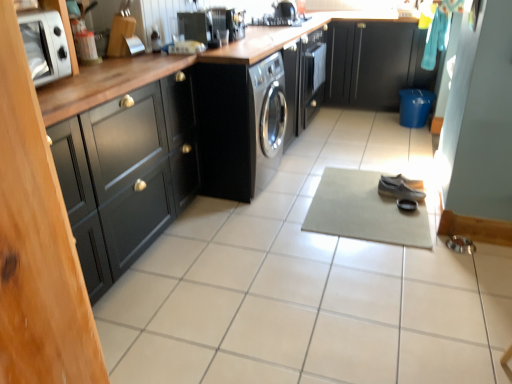
The height and width of the screenshot is (384, 512). What are the coordinates of `free spot to the right of silver metallic microwave at upper left` in the screenshot? It's located at (90, 87).